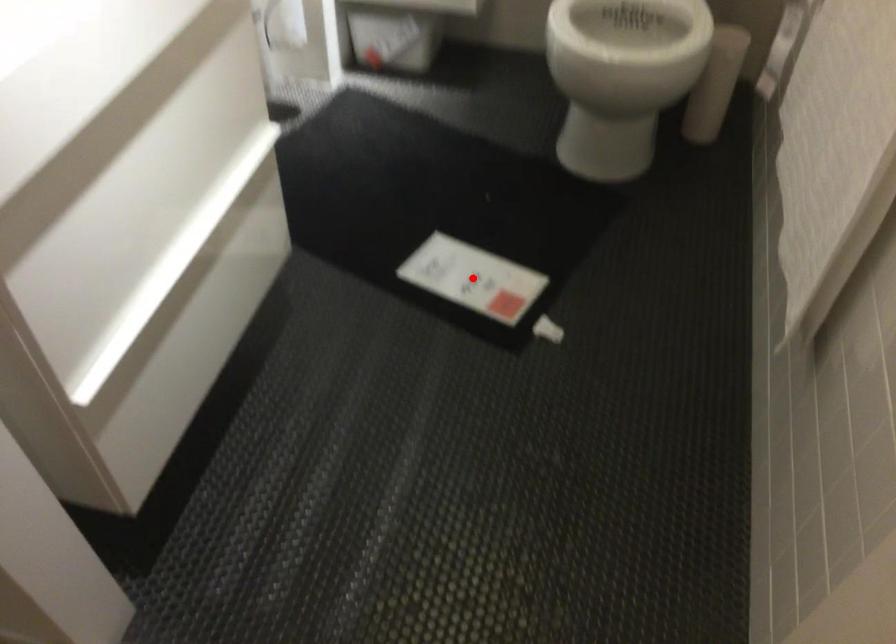
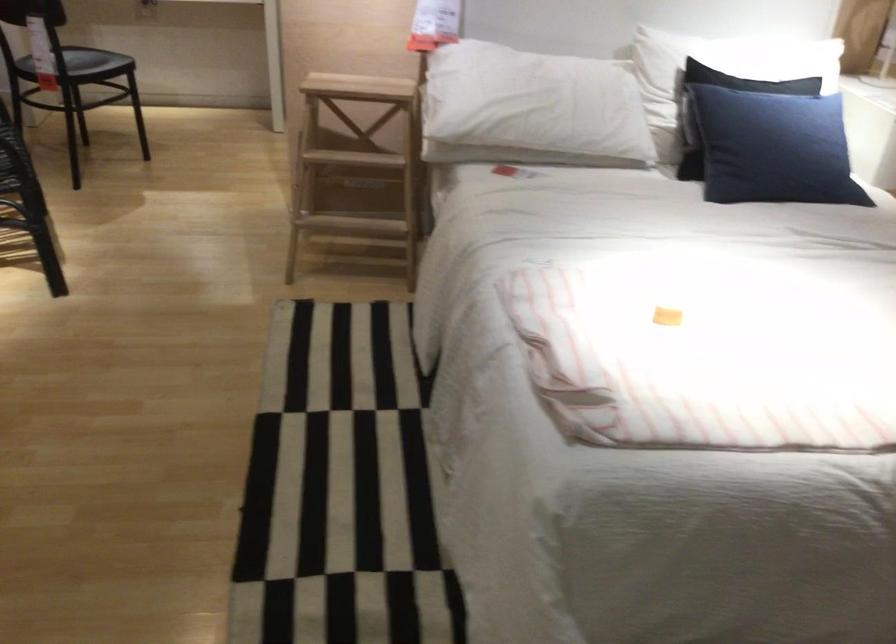
Question: I am providing you with two images of the same scene from different viewpoints. A red point is marked on the first image. Can you still see the location of the red point in image 2?

Choices:
 (A) Yes
 (B) No

Answer: (B)